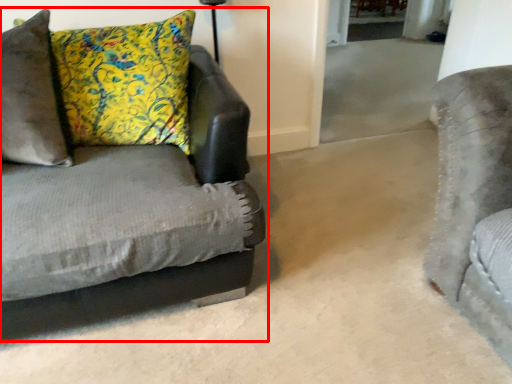
Question: Observing the image, what is the correct spatial positioning of studio couch (annotated by the red box) in reference to pillow?

Choices:
 (A) right
 (B) left

Answer: (A)